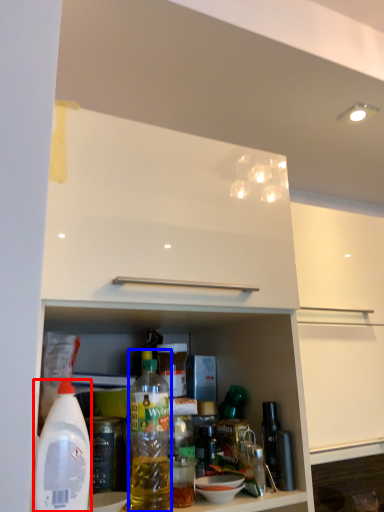
Question: Which object appears farthest to the camera in this image, bottle (highlighted by a red box) or bottle (highlighted by a blue box)?

Choices:
 (A) bottle
 (B) bottle

Answer: (B)